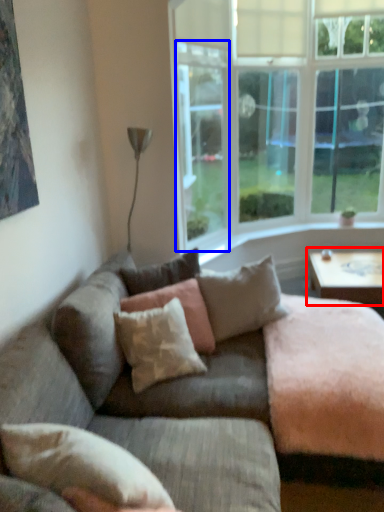
Question: Among these objects, which one is farthest to the camera, coffee table (highlighted by a red box) or window screen (highlighted by a blue box)?

Choices:
 (A) coffee table
 (B) window screen

Answer: (A)